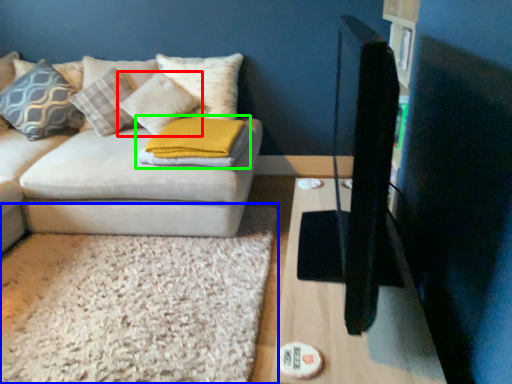
Question: Which object is the farthest from pillow (highlighted by a red box)? Choose among these: mat (highlighted by a blue box) or pillow (highlighted by a green box).

Choices:
 (A) mat
 (B) pillow

Answer: (A)